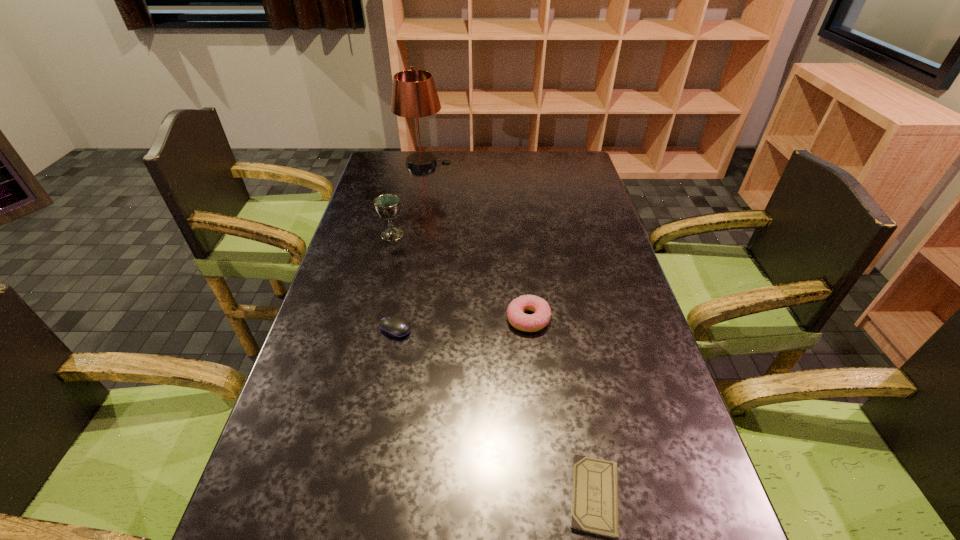
The width and height of the screenshot is (960, 540). Identify the location of free spot that satisfies the following two spatial constraints: 1. on the back side of the shortest object; 2. on the front-facing side of the lampshade. (533, 164).